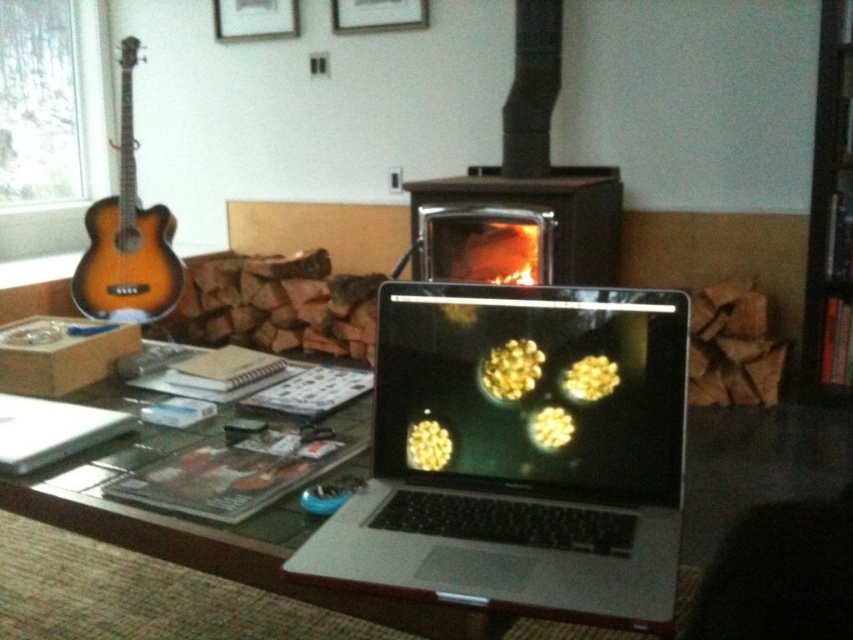
Question: Which of the following is the farthest from the observer?

Choices:
 (A) black wood bookshelf at upper right
 (B) sunburst wood guitar at left

Answer: (B)

Question: Is black matte fireplace at center bigger than brushed metal picture frame at upper center?

Choices:
 (A) no
 (B) yes

Answer: (B)

Question: Does silver metallic laptop at center appear on the left side of brushed metal picture frame at upper center?

Choices:
 (A) no
 (B) yes

Answer: (A)

Question: Estimate the real-world distances between objects in this image. Which object is farther from the black wood bookshelf at upper right?

Choices:
 (A) matte white picture frame at upper center
 (B) sunburst wood guitar at left
 (C) black matte fireplace at center
 (D) brushed metal picture frame at upper center

Answer: (B)

Question: Which of the following is the farthest from the observer?

Choices:
 (A) brushed metal picture frame at upper center
 (B) sunburst wood guitar at left
 (C) glass/matte table at center

Answer: (A)

Question: Considering the relative positions of sunburst wood guitar at left and matte white picture frame at upper center in the image provided, where is sunburst wood guitar at left located with respect to matte white picture frame at upper center?

Choices:
 (A) left
 (B) right

Answer: (A)